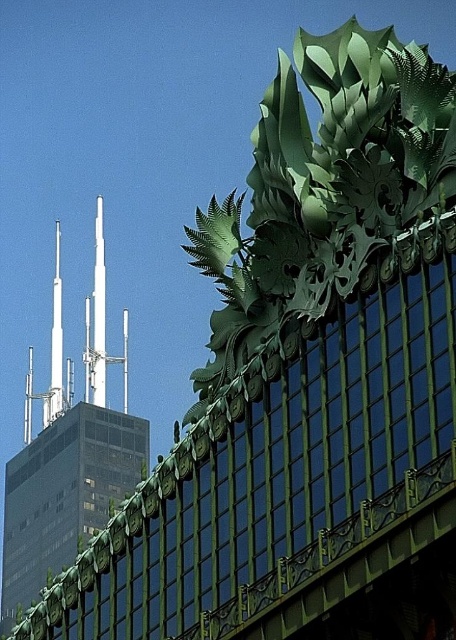
Does white metallic spire at upper center have a lesser height compared to white glossy spire at upper left?

No.

Can you confirm if white metallic spire at upper center is smaller than white glossy spire at upper left?

Actually, white metallic spire at upper center might be larger than white glossy spire at upper left.

The width and height of the screenshot is (456, 640). I want to click on white metallic spire at upper center, so click(x=100, y=328).